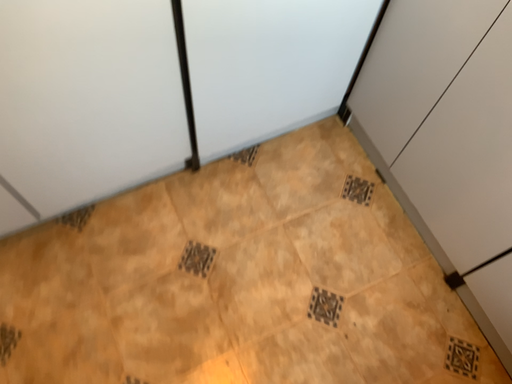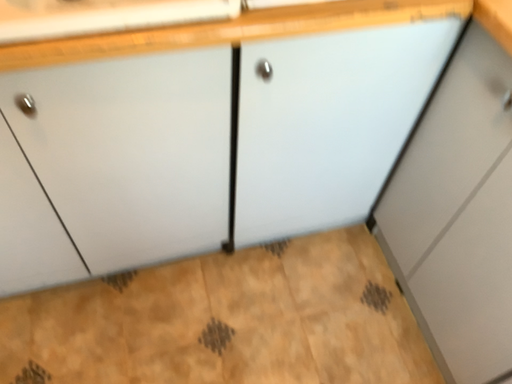
Question: How did the camera likely rotate when shooting the video?

Choices:
 (A) rotated downward
 (B) rotated upward

Answer: (B)